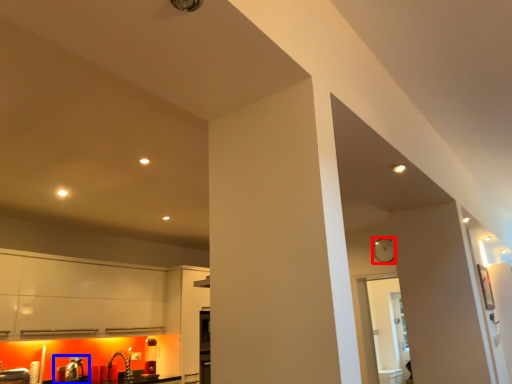
Question: Which point is further to the camera, clock (highlighted by a red box) or sink (highlighted by a blue box)?

Choices:
 (A) clock
 (B) sink

Answer: (A)